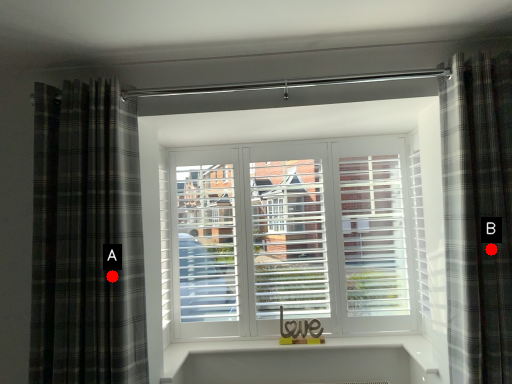
Question: Two points are circled on the image, labeled by A and B beside each circle. Which point is closer to the camera?

Choices:
 (A) A is closer
 (B) B is closer

Answer: (B)